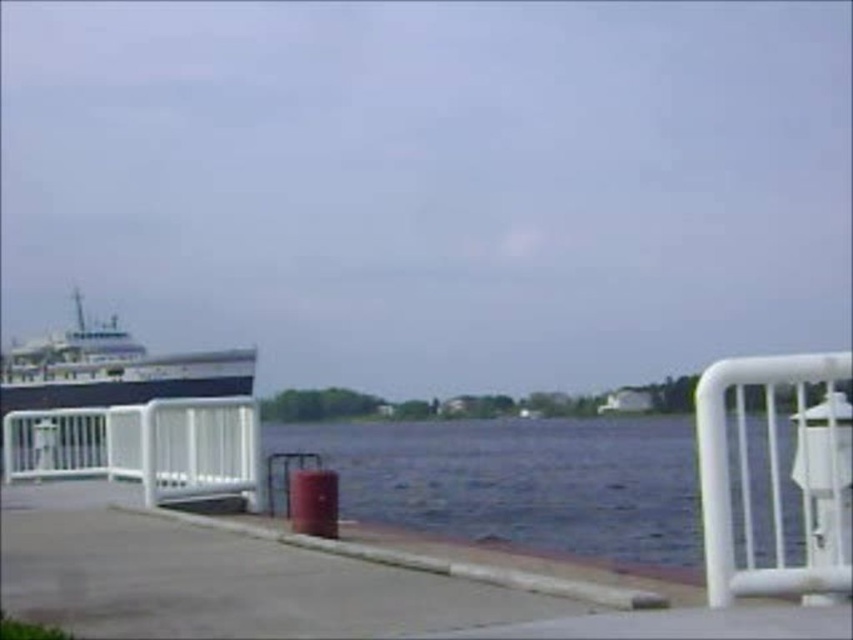
Question: Where is white metal fence at left located in relation to white plastic rail at right in the image?

Choices:
 (A) right
 (B) left

Answer: (B)

Question: Does gray concrete pavement at center come behind white plastic rail at right?

Choices:
 (A) no
 (B) yes

Answer: (B)

Question: Which of these objects is positioned farthest from the gray concrete pavement at center?

Choices:
 (A) white metal fence at left
 (B) white plastic rail at right

Answer: (A)

Question: Which is nearer to the white metal fence at left?

Choices:
 (A) white plastic rail at right
 (B) gray concrete pavement at center

Answer: (A)

Question: Does white metal fence at left have a greater width compared to white plastic rail at right?

Choices:
 (A) yes
 (B) no

Answer: (A)

Question: Among these points, which one is farthest from the camera?

Choices:
 (A) (724, 481)
 (B) (418, 612)
 (C) (247, 413)

Answer: (C)